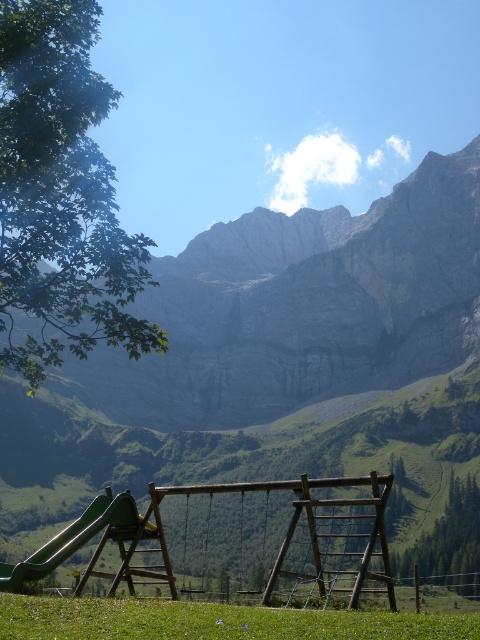
Between green grassy field at lower center and green plastic slide at lower left, which one is positioned lower?

green plastic slide at lower left is below.

Where is `green grassy field at lower center`? The width and height of the screenshot is (480, 640). green grassy field at lower center is located at coordinates (213, 620).

Who is more forward, (168,604) or (2,582)?

Point (2,582) is more forward.

Where is `green grassy field at lower center`? The height and width of the screenshot is (640, 480). green grassy field at lower center is located at coordinates (213, 620).

Can you confirm if gray rock mountain at upper center is smaller than green grassy field at lower center?

No.

Does gray rock mountain at upper center appear on the left side of green grassy field at lower center?

In fact, gray rock mountain at upper center is to the right of green grassy field at lower center.

Locate an element on the screen. The width and height of the screenshot is (480, 640). gray rock mountain at upper center is located at coordinates (305, 307).

Who is lower down, gray rock mountain at upper center or green plastic slide at lower left?

green plastic slide at lower left is below.

Does gray rock mountain at upper center appear under green plastic slide at lower left?

Actually, gray rock mountain at upper center is above green plastic slide at lower left.

The width and height of the screenshot is (480, 640). Identify the location of gray rock mountain at upper center. (305, 307).